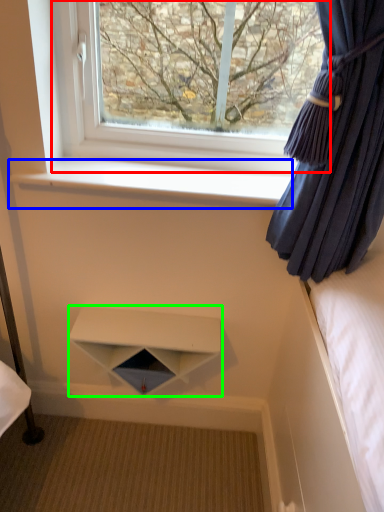
Question: Which object is positioned farthest from window (highlighted by a red box)? Select from window sill (highlighted by a blue box) and shelf (highlighted by a green box).

Choices:
 (A) window sill
 (B) shelf

Answer: (B)